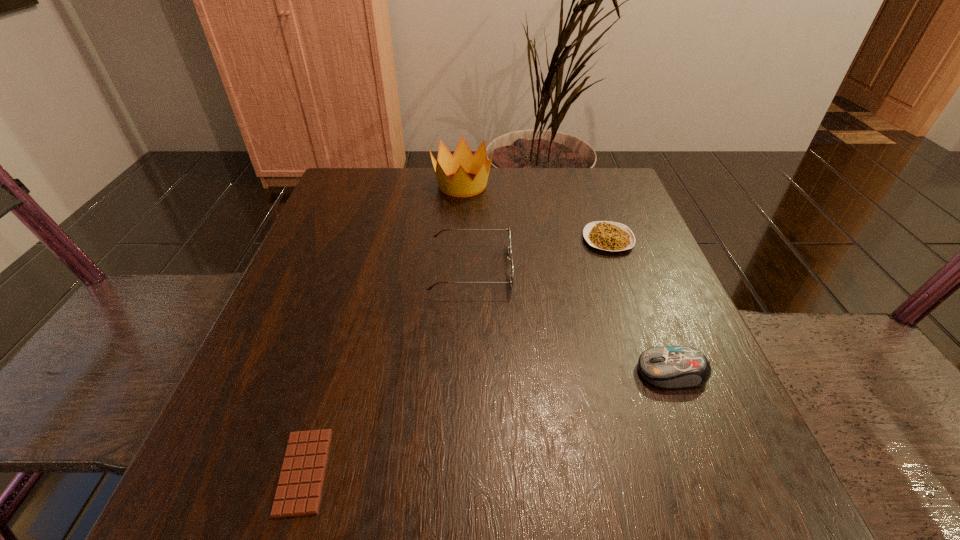
What are the coordinates of `blank region between the third shortest object and the farthest object` in the screenshot? It's located at tap(567, 278).

You are a GUI agent. You are given a task and a screenshot of the screen. Output one action in this format:
    pyautogui.click(x=<x>, y=<y>)
    Task: Click on the free space that is in between the fourth shortest object and the second nearest object
    The width and height of the screenshot is (960, 540).
    Given the screenshot: What is the action you would take?
    pyautogui.click(x=571, y=320)

At what (x,y) coordinates should I click in order to perform the action: click on free space between the third shortest object and the farthest object. Please return your answer as a coordinate pair (x, y). The height and width of the screenshot is (540, 960). Looking at the image, I should click on (567, 278).

The height and width of the screenshot is (540, 960). I want to click on empty location between the legume and the farthest object, so click(x=536, y=212).

Identify the location of empty location between the candy bar and the second tallest object. (387, 369).

Locate an element on the screen. This screenshot has width=960, height=540. unoccupied area between the sunglasses and the nearest object is located at coordinates (387, 369).

Image resolution: width=960 pixels, height=540 pixels. In order to click on vacant space that's between the legume and the crown in this screenshot , I will do `click(536, 212)`.

Identify the location of unoccupied area between the fourth farthest object and the sunglasses. The image size is (960, 540). (571, 320).

You are a GUI agent. You are given a task and a screenshot of the screen. Output one action in this format:
    pyautogui.click(x=<x>, y=<y>)
    Task: Click on the object that can be found as the third closest to the legume
    The image size is (960, 540).
    Given the screenshot: What is the action you would take?
    pyautogui.click(x=670, y=367)

Identify which object is located as the fourth nearest to the crown. Please provide its 2D coordinates. Your answer should be formatted as a tuple, i.e. [(x, y)], where the tuple contains the x and y coordinates of a point satisfying the conditions above.

[(298, 493)]